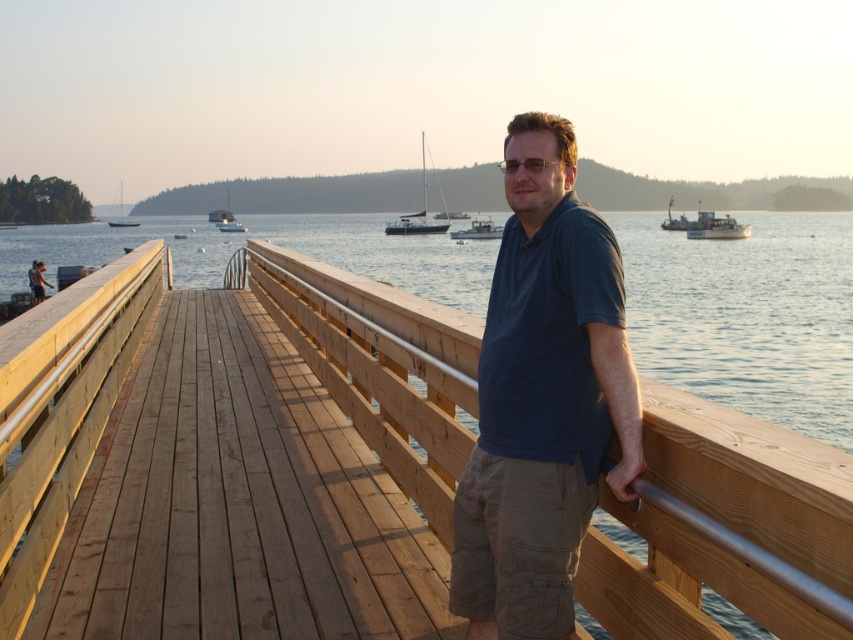
Question: Does wooden at center appear on the left side of clear water at center?

Choices:
 (A) no
 (B) yes

Answer: (A)

Question: Considering the relative positions of clear water at center and dark blue shirt at center in the image provided, where is clear water at center located with respect to dark blue shirt at center?

Choices:
 (A) below
 (B) above

Answer: (B)

Question: Which point is farther to the camera?

Choices:
 (A) clear water at center
 (B) white glossy sailboat at center
 (C) white sailboat at upper left

Answer: (C)

Question: Does white plastic boat at right lie in front of white glossy sailboat at center?

Choices:
 (A) no
 (B) yes

Answer: (B)

Question: Estimate the real-world distances between objects in this image. Which object is closer to the white sailboat at upper left?

Choices:
 (A) wooden at center
 (B) white matte boat at center
 (C) clear water at center
 (D) white glossy sailboat at upper left

Answer: (D)

Question: Among these objects, which one is farthest from the camera?

Choices:
 (A) white plastic boat at right
 (B) clear water at center
 (C) white glossy sailboat at upper left
 (D) white matte boat at center

Answer: (C)